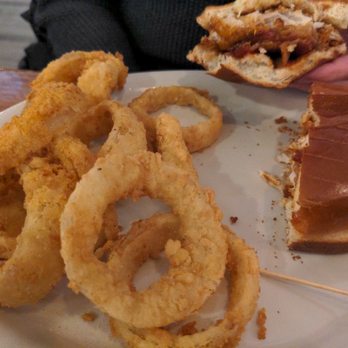
Locate an element on the screen. This screenshot has height=348, width=348. white plate is located at coordinates (233, 98).